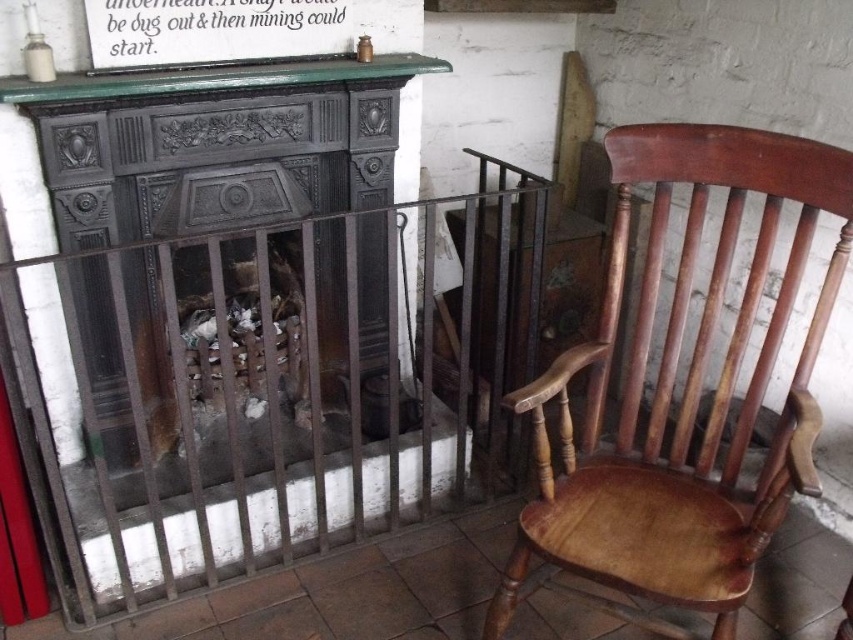
You are standing in a room and want to place a decorative item on the dark gray cast iron fireplace at center. If your arm reaches 4 feet, can you reach the fireplace without moving closer?

The dark gray cast iron fireplace at center is 4.51 feet away from the viewer. Since your arm reaches 4 feet, you cannot reach the fireplace without moving closer.

You are an interior designer assessing the space for a client who wants to hang a large painting. The painting is 1.8 meters tall. The client wants to know if the dark gray cast iron fireplace at center and the green painted wood mantle at upper center can accommodate the painting vertically. Can they?

The dark gray cast iron fireplace at center is much taller than the green painted wood mantle at upper center. However, the exact dimensions are not provided. Since the painting is 1.8 meters tall, it would depend on the actual height of the fireplace and mantle. Without specific measurements, it is uncertain if they can accommodate the painting vertically.

You are sitting in the wooden chair at right and want to place a book on the shelf above the dark gray cast iron fireplace at center. Can you reach it from your current position?

The dark gray cast iron fireplace at center is located above the wooden chair at right, so the shelf above the fireplace is higher than the chair. You might need to stand or use a stool to reach it.